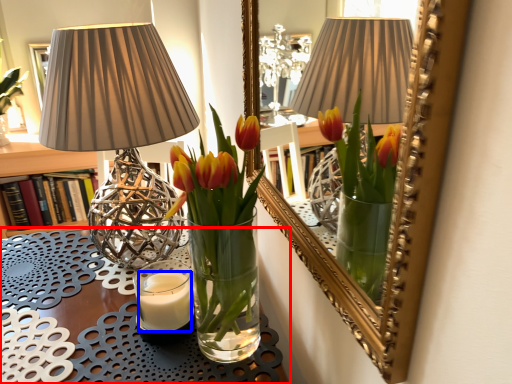
Question: Which object is closer to the camera taking this photo, table (highlighted by a red box) or candle (highlighted by a blue box)?

Choices:
 (A) table
 (B) candle

Answer: (A)